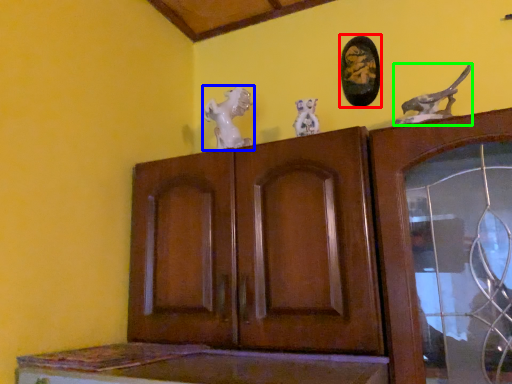
Question: Which object is positioned closest to picture frame (highlighted by a red box)? Select from animal (highlighted by a blue box) and animal (highlighted by a green box).

Choices:
 (A) animal
 (B) animal

Answer: (B)